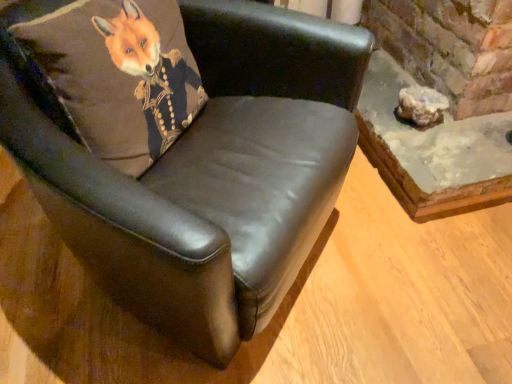
Question: Is black leather chair at upper left bigger or smaller than translucent white rock at lower right?

Choices:
 (A) small
 (B) big

Answer: (B)

Question: Considering the positions of black leather chair at upper left and translucent white rock at lower right in the image, is black leather chair at upper left taller or shorter than translucent white rock at lower right?

Choices:
 (A) tall
 (B) short

Answer: (A)

Question: Which of these objects is positioned closest to the rustic concrete table at lower right?

Choices:
 (A) black leather chair at upper left
 (B) translucent white rock at lower right
 (C) brown leather pillow at upper left

Answer: (B)

Question: Which object is positioned closest to the rustic concrete table at lower right?

Choices:
 (A) translucent white rock at lower right
 (B) black leather chair at upper left
 (C) brown leather pillow at upper left

Answer: (A)